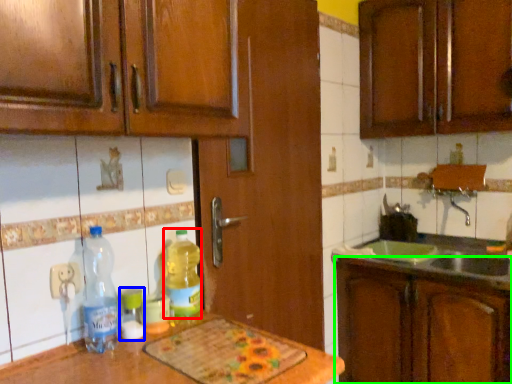
Question: Which object is the closest to the bottle (highlighted by a red box)? Choose among these: bottle (highlighted by a blue box) or cabinetry (highlighted by a green box).

Choices:
 (A) bottle
 (B) cabinetry

Answer: (A)